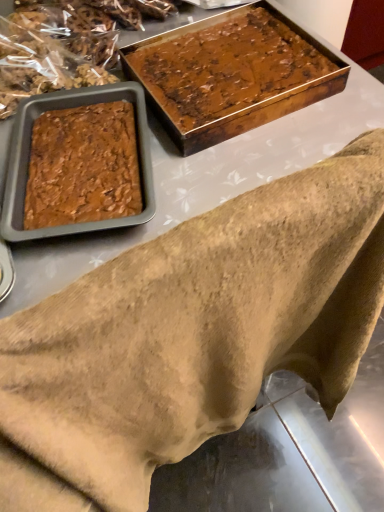
Question: Looking at their shapes, would you say brown fuzzy blanket at lower left is wider or thinner than shiny brown cake at upper right?

Choices:
 (A) thin
 (B) wide

Answer: (A)

Question: In the image, is brown fuzzy blanket at lower left positioned in front of or behind shiny brown cake at upper right?

Choices:
 (A) front
 (B) behind

Answer: (A)

Question: From a real-world perspective, is brown fuzzy blanket at lower left physically located above or below shiny brown cake at upper right?

Choices:
 (A) below
 (B) above

Answer: (A)

Question: Based on their positions, is shiny brown cake at upper right located to the left or right of brown fuzzy blanket at lower left?

Choices:
 (A) right
 (B) left

Answer: (A)

Question: Considering the positions of shiny brown cake at upper right and brown fuzzy blanket at lower left in the image, is shiny brown cake at upper right taller or shorter than brown fuzzy blanket at lower left?

Choices:
 (A) short
 (B) tall

Answer: (A)

Question: From a real-world perspective, is shiny brown cake at upper right physically located above or below brown fuzzy blanket at lower left?

Choices:
 (A) below
 (B) above

Answer: (B)

Question: Is point (256, 48) positioned closer to the camera than point (284, 186)?

Choices:
 (A) farther
 (B) closer

Answer: (A)